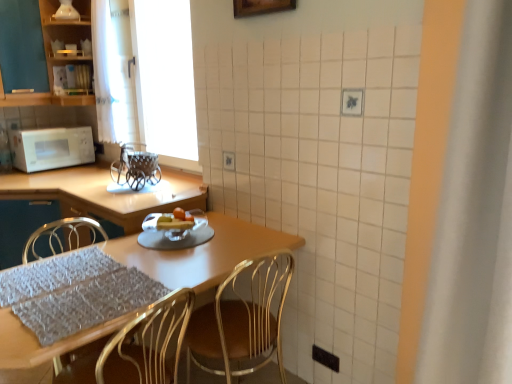
What is the approximate width of metallic gold chair at center?

The width of metallic gold chair at center is 17.64 inches.

Describe the element at coordinates (174, 225) in the screenshot. I see `translucent glass fruit dish at center` at that location.

This screenshot has height=384, width=512. Identify the location of wooden table at center. (204, 253).

What do you see at coordinates (74, 293) in the screenshot? I see `gray textured placemat at lower left` at bounding box center [74, 293].

At what (x,y) coordinates should I click in order to perform the action: click on white matte window screen at upper left. Please return your answer as a coordinate pair (x, y). Looking at the image, I should click on (164, 76).

Find the location of a particular element. The image size is (512, 384). metallic gold chair at center is located at coordinates (242, 318).

From the image's perspective, relative to matte black cabinet at upper left, is metallic gold chair at center above or below?

metallic gold chair at center is below matte black cabinet at upper left.

Could you tell me if metallic gold chair at center is turned towards matte black cabinet at upper left?

Yes, metallic gold chair at center is aimed at matte black cabinet at upper left.

In terms of height, does metallic gold chair at center look taller or shorter compared to matte black cabinet at upper left?

metallic gold chair at center is taller than matte black cabinet at upper left.

Is metallic gold chair at center next to matte black cabinet at upper left?

There is a gap between metallic gold chair at center and matte black cabinet at upper left.

Considering the relative positions of matte black cabinet at upper left and metallic gold chair at center in the image provided, is matte black cabinet at upper left behind metallic gold chair at center?

Yes, the depth of matte black cabinet at upper left is greater than that of metallic gold chair at center.

Would you say matte black cabinet at upper left is outside metallic gold chair at center?

That's correct, matte black cabinet at upper left is outside of metallic gold chair at center.

Is matte black cabinet at upper left oriented towards metallic gold chair at center?

Yes, matte black cabinet at upper left is turned towards metallic gold chair at center.

Considering the positions of point (55, 6) and point (225, 288), is point (55, 6) closer or farther from the camera than point (225, 288)?

Point (55, 6) is positioned farther from the camera compared to point (225, 288).

Is gray textured placemat at lower left a part of metallic gold chair at center?

No.

From the picture: Considering the relative sizes of metallic gold chair at center and gray textured placemat at lower left in the image provided, is metallic gold chair at center thinner than gray textured placemat at lower left?

Indeed, metallic gold chair at center has a lesser width compared to gray textured placemat at lower left.

Between metallic gold chair at center and gray textured placemat at lower left, which one has less height?

With less height is gray textured placemat at lower left.

Could you tell me if metallic gold chair at center is facing gray textured placemat at lower left?

No, metallic gold chair at center does not turn towards gray textured placemat at lower left.

Which is more to the left, white matte microwave oven at left or wooden table at center?

Positioned to the left is white matte microwave oven at left.

Is white matte microwave oven at left in contact with wooden table at center?

They are not placed beside each other.

From a real-world perspective, is white matte microwave oven at left located higher than wooden table at center?

Yes, from a real-world perspective, white matte microwave oven at left is on top of wooden table at center.

Could you tell me if white matte microwave oven at left is turned towards wooden table at center?

No, white matte microwave oven at left is not oriented towards wooden table at center.

Considering the relative sizes of gray textured placemat at lower left and white matte microwave oven at left in the image provided, is gray textured placemat at lower left thinner than white matte microwave oven at left?

No, gray textured placemat at lower left is not thinner than white matte microwave oven at left.

From the image's perspective, is gray textured placemat at lower left located beneath white matte microwave oven at left?

Yes, from the image's perspective, gray textured placemat at lower left is below white matte microwave oven at left.

Considering the positions of objects gray textured placemat at lower left and white matte microwave oven at left in the image provided, who is more to the left, gray textured placemat at lower left or white matte microwave oven at left?

white matte microwave oven at left.

What are the coordinates of `microwave oven located behind the gray textured placemat at lower left` in the screenshot? It's located at coord(51,148).

Can you confirm if matte black cabinet at upper left is taller than wooden table at center?

Yes, matte black cabinet at upper left is taller than wooden table at center.

Considering the relative positions of matte black cabinet at upper left and wooden table at center in the image provided, is matte black cabinet at upper left to the left of wooden table at center from the viewer's perspective?

Yes.

Identify the location of table that appears in front of the matte black cabinet at upper left. (204, 253).

Is wooden table at center located within matte black cabinet at upper left?

No, wooden table at center is not inside matte black cabinet at upper left.

Is white matte window screen at upper left inside or outside of white matte microwave oven at left?

The correct answer is: outside.

Measure the distance from white matte window screen at upper left to white matte microwave oven at left.

The distance of white matte window screen at upper left from white matte microwave oven at left is 30.43 inches.

Between white matte window screen at upper left and white matte microwave oven at left, which one has smaller size?

With smaller size is white matte microwave oven at left.

From the image's perspective, is white matte window screen at upper left under white matte microwave oven at left?

No, from the image's perspective, white matte window screen at upper left is not beneath white matte microwave oven at left.

This screenshot has width=512, height=384. I want to click on cabinetry above the metallic gold chair at center (from the image's perspective), so click(57, 57).

Identify the location of chair in front of the matte black cabinet at upper left. tap(242, 318).

Based on their spatial positions, is translucent glass fruit dish at center or white matte window screen at upper left closer to metallic gold chair at center?

translucent glass fruit dish at center.

Estimate the real-world distances between objects in this image. Which object is closer to translucent glass fruit dish at center, metallic basket at center or wooden table at center?

Based on the image, wooden table at center appears to be nearer to translucent glass fruit dish at center.

Looking at the image, which one is located further to metallic basket at center, translucent glass fruit dish at center or gray textured placemat at lower left?

gray textured placemat at lower left is further to metallic basket at center.

When comparing their distances from white matte microwave oven at left, does translucent glass fruit dish at center or white matte window screen at upper left seem closer?

white matte window screen at upper left is positioned closer to the anchor white matte microwave oven at left.

Which object lies further to the anchor point matte black cabinet at upper left, translucent glass fruit dish at center or wooden table at center?

Based on the image, wooden table at center appears to be further to matte black cabinet at upper left.

Looking at the image, which one is located closer to metallic basket at center, metallic gold chair at center or wooden table at center?

wooden table at center is positioned closer to the anchor metallic basket at center.

When comparing their distances from gray textured placemat at lower left, does white matte microwave oven at left or matte black cabinet at upper left seem further?

Based on the image, matte black cabinet at upper left appears to be further to gray textured placemat at lower left.

Based on their spatial positions, is metallic basket at center or gray textured placemat at lower left further from metallic gold chair at center?

The object further to metallic gold chair at center is metallic basket at center.

Locate an element on the screen. Image resolution: width=512 pixels, height=384 pixels. window screen positioned between metallic gold chair at center and white matte microwave oven at left from near to far is located at coordinates (164, 76).

Where is `microwave oven situated between matte black cabinet at upper left and white matte window screen at upper left from left to right`? microwave oven situated between matte black cabinet at upper left and white matte window screen at upper left from left to right is located at coordinates (51, 148).

Image resolution: width=512 pixels, height=384 pixels. I want to click on fruit dish located between wooden table at center and white matte microwave oven at left in the depth direction, so [x=174, y=225].

Locate an element on the screen. Image resolution: width=512 pixels, height=384 pixels. fruit dish positioned between gray textured placemat at lower left and metallic basket at center from near to far is located at coordinates (174, 225).